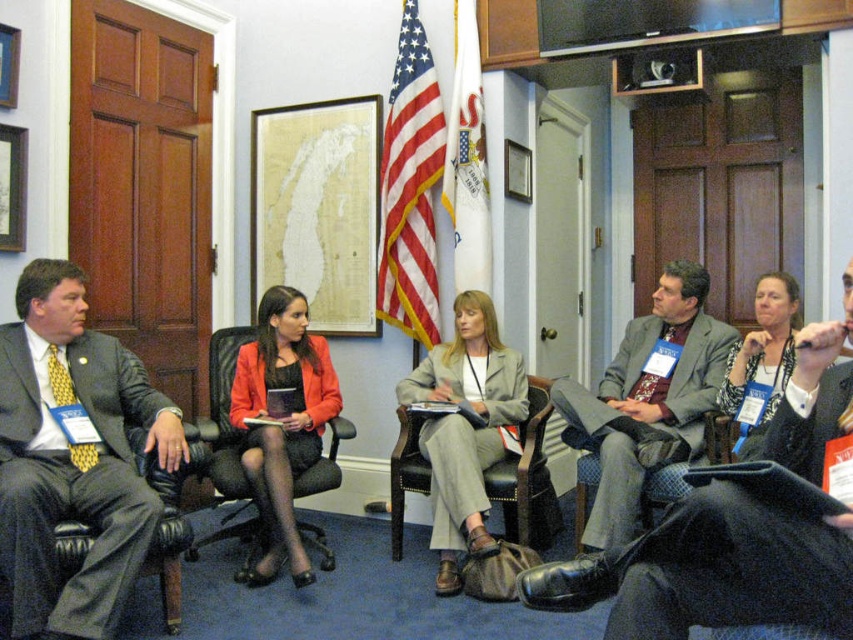
Can you confirm if matte red blazer at center is positioned above black leather chair at center?

Yes.

Find the location of `matte red blazer at center`. matte red blazer at center is located at coordinates (282, 420).

The width and height of the screenshot is (853, 640). Identify the location of matte red blazer at center. point(282,420).

Between matte red blazer at center and matte gray blazer at center, which one has more height?

With more height is matte red blazer at center.

Is matte red blazer at center closer to the viewer compared to matte gray blazer at center?

No.

Does point (241, 387) come farther from viewer compared to point (770, 298)?

Yes, it is.

Image resolution: width=853 pixels, height=640 pixels. I want to click on matte red blazer at center, so click(x=282, y=420).

Can you confirm if gray wool suit at center is taller than matte red blazer at center?

No, gray wool suit at center is not taller than matte red blazer at center.

Between gray wool suit at center and matte red blazer at center, which one has more height?

matte red blazer at center

Does point (604, 474) come closer to viewer compared to point (283, 420)?

Yes.

Locate an element on the screen. The image size is (853, 640). gray wool suit at center is located at coordinates (647, 397).